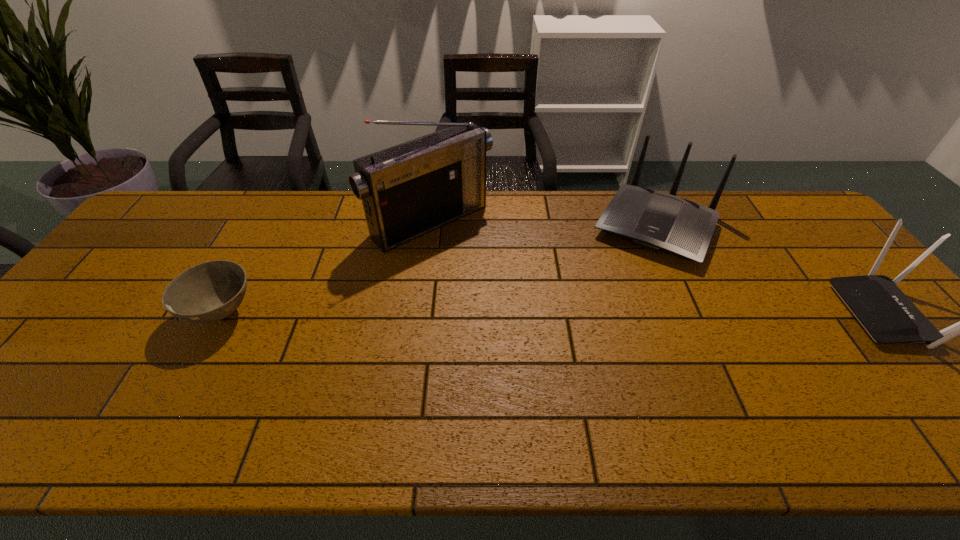
Find the location of a particular element. The width and height of the screenshot is (960, 540). free spot between the bowl and the third object from left to right is located at coordinates (439, 270).

The image size is (960, 540). I want to click on vacant area that lies between the radio receiver and the leftmost object, so click(x=326, y=268).

Locate an element on the screen. free space between the tallest object and the taller router is located at coordinates (543, 225).

Find the location of a particular element. empty location between the radio receiver and the taller router is located at coordinates (543, 225).

The image size is (960, 540). I want to click on free area in between the tallest object and the shortest object, so click(x=326, y=268).

This screenshot has width=960, height=540. Find the location of `vacant area that lies between the left router and the tallest object`. vacant area that lies between the left router and the tallest object is located at coordinates (543, 225).

At what (x,y) coordinates should I click in order to perform the action: click on object that stands as the second closest to the right router. Please return your answer as a coordinate pair (x, y). The image size is (960, 540). Looking at the image, I should click on click(408, 190).

This screenshot has width=960, height=540. I want to click on object that is the second nearest to the leftmost object, so [x=654, y=220].